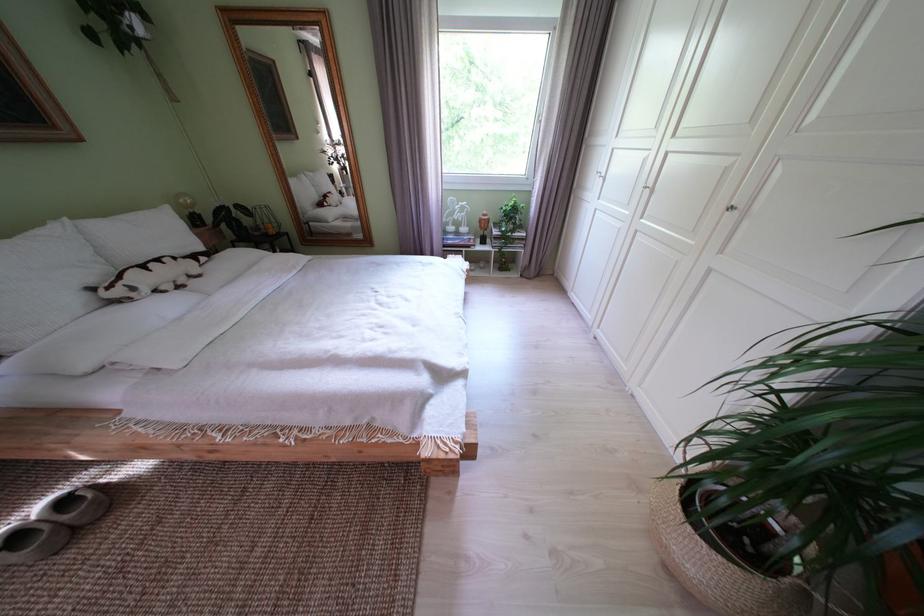
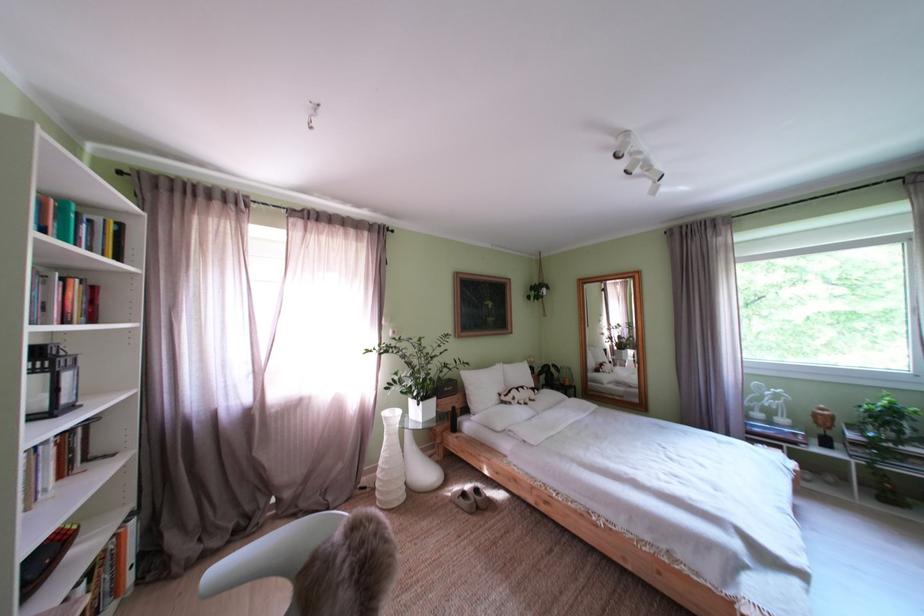
In the second image, find the point that corresponds to point 28,543 in the first image.

(475, 500)